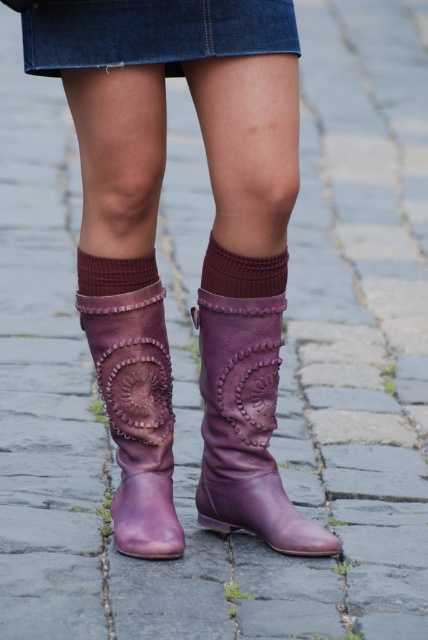
You are trying to put on your purple leather boot at lower center and smokey brown knit sock at upper center. Which item requires a wider space to wear?

The purple leather boot at lower center requires a wider space to wear because its width is larger than the smokey brown knit sock at upper center.

You are a fashion stylist and need to adjust the position of the purple leather boot at lower center and the smokey brown knit sock at upper center for a better look. According to their current positions, which item is positioned to the right side?

The purple leather boot at lower center is to the right of the smokey brown knit sock at upper center.

In the scene shown: What object in the image corresponds to the point located at coordinates (152,33)?

The point at coordinates (152,33) corresponds to the denim skirt at upper center.